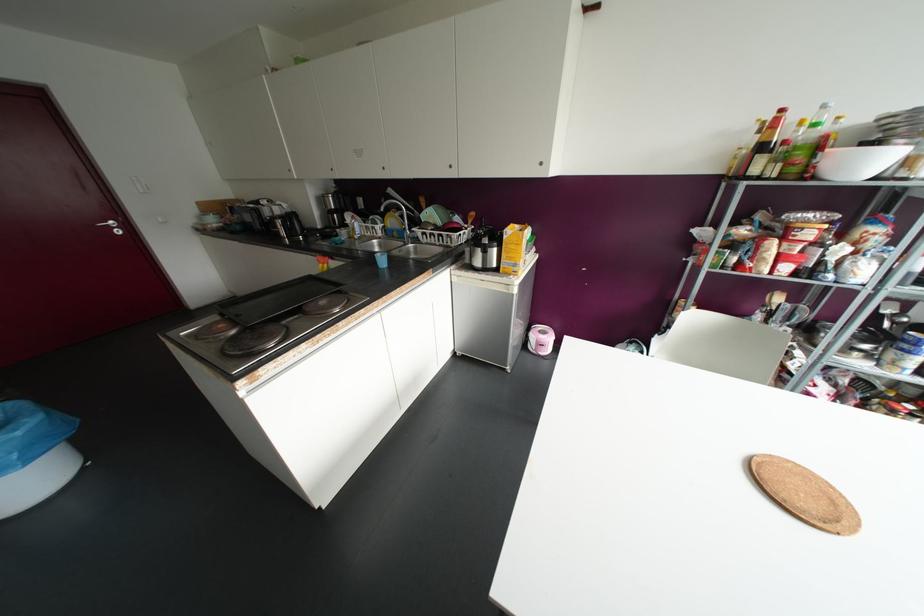
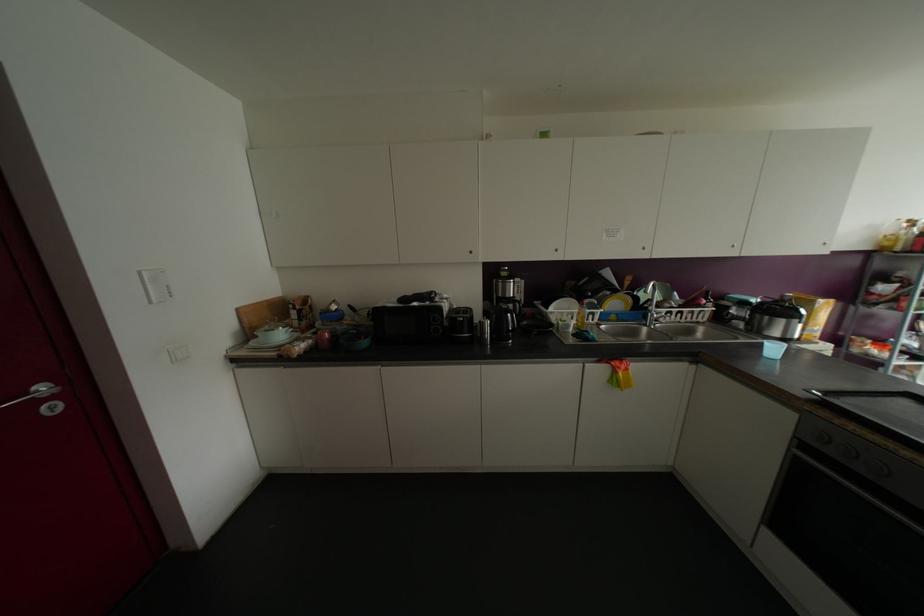
Find the pixel in the second image that matches (x=237, y=227) in the first image.

(363, 342)